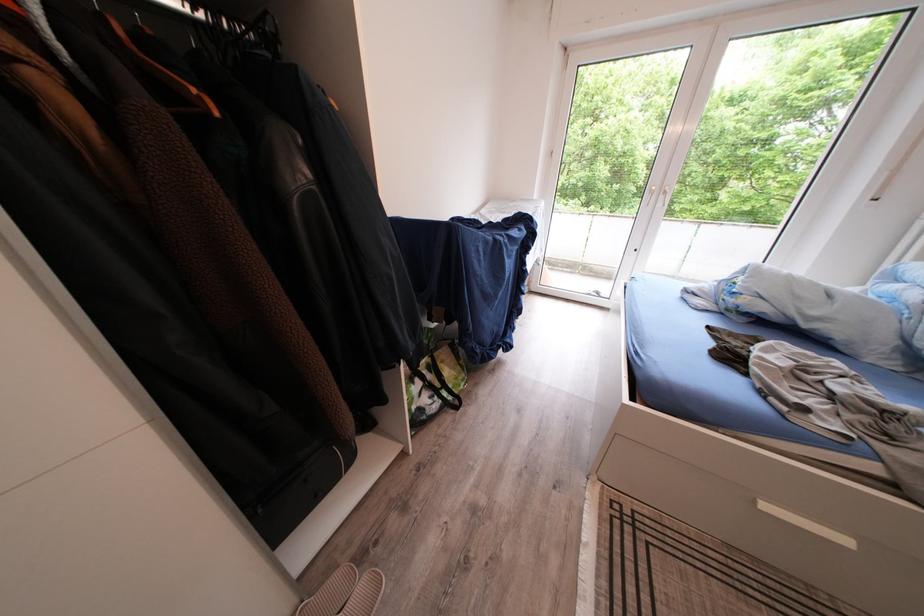
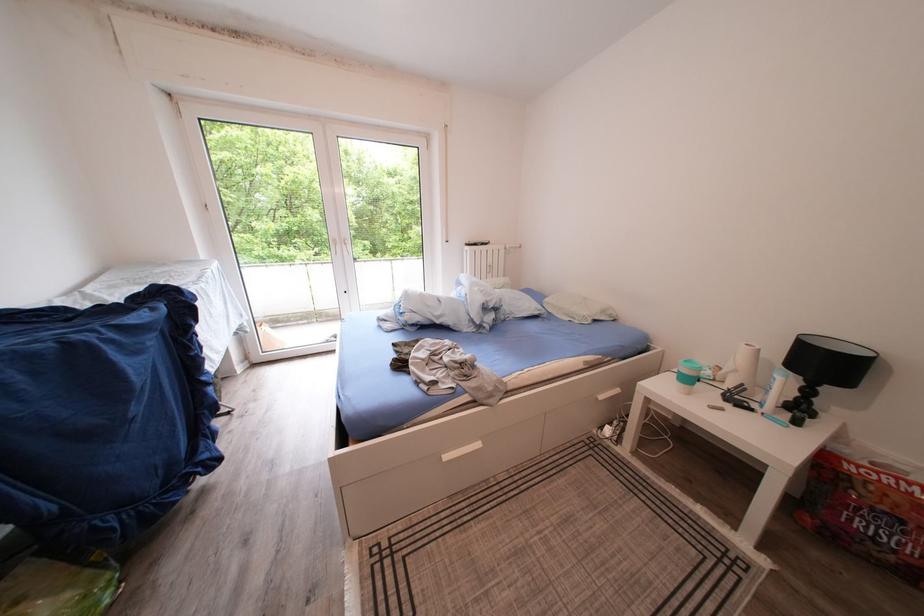
Question: The camera is either moving clockwise (left) or counter-clockwise (right) around the object. The first image is from the beginning of the video and the second image is from the end. Is the camera moving left or right when shooting the video?

Choices:
 (A) Left
 (B) Right

Answer: (A)